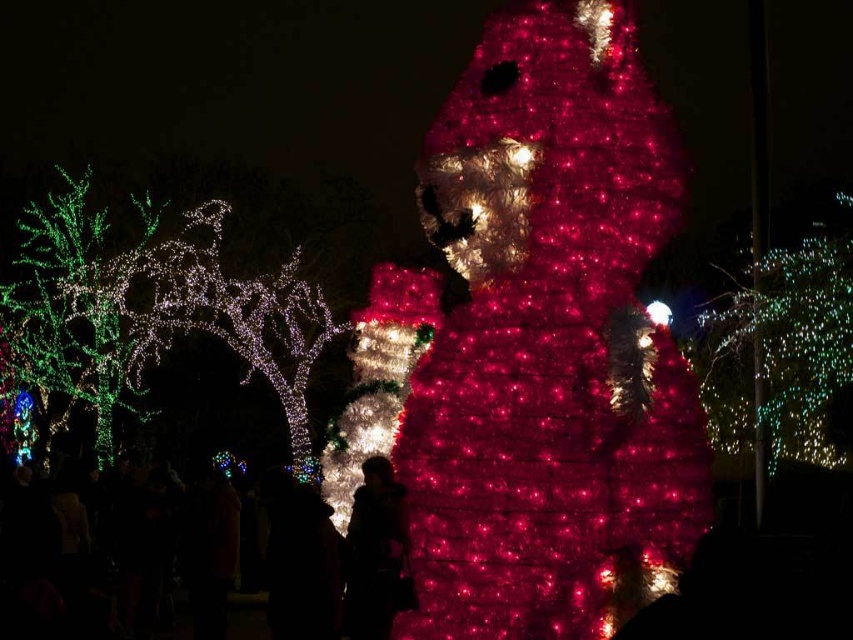
Is shiny red lights at center smaller than green glittering lights at left?

Yes.

Who is more distant from viewer, (596, 1) or (59, 282)?

The point (59, 282) is more distant.

Does point (390, 285) come in front of point (61, 225)?

Yes.

Locate an element on the screen. shiny red lights at center is located at coordinates (546, 340).

Is green wire tree at left to the right of silhouette fabric person at center from the viewer's perspective?

In fact, green wire tree at left is to the left of silhouette fabric person at center.

How distant is green wire tree at left from silhouette fabric person at center?

16.22 meters

Does point (103, 410) come in front of point (396, 506)?

That is False.

Image resolution: width=853 pixels, height=640 pixels. I want to click on green wire tree at left, so click(149, 308).

Who is taller, green glittering lights at left or silhouette fabric person at center?

green glittering lights at left

Is green glittering lights at left positioned at the back of silhouette fabric person at center?

Yes.

Is point (22, 337) positioned in front of point (369, 538)?

No, (22, 337) is further to viewer.

The image size is (853, 640). Find the location of `green glittering lights at left`. green glittering lights at left is located at coordinates (74, 305).